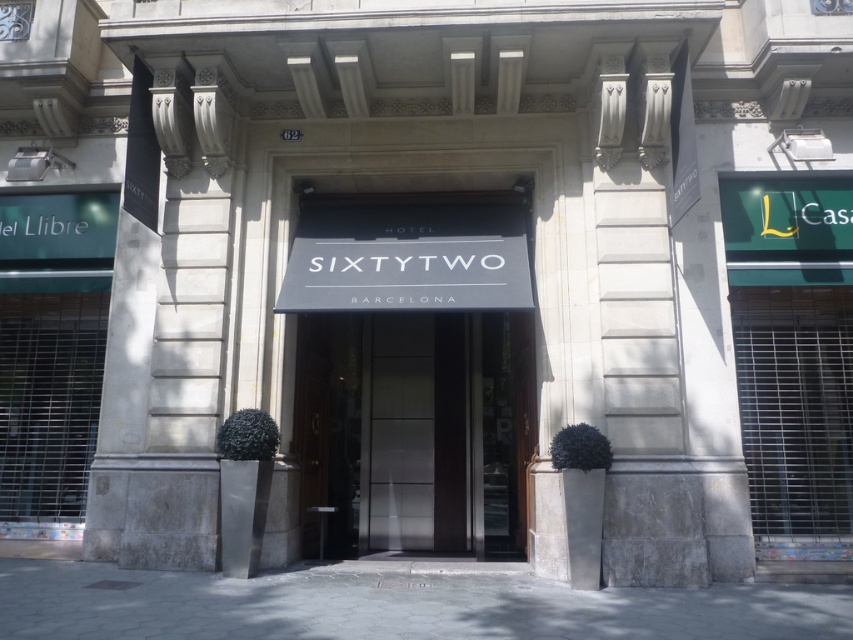
Image resolution: width=853 pixels, height=640 pixels. I want to click on satin black door at center, so [x=415, y=432].

This screenshot has height=640, width=853. In order to click on satin black door at center in this screenshot , I will do `click(415, 432)`.